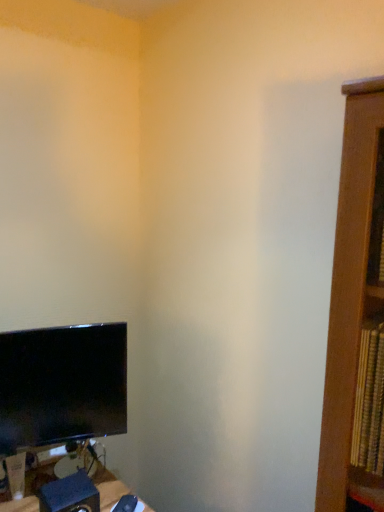
Image resolution: width=384 pixels, height=512 pixels. Describe the element at coordinates (70, 494) in the screenshot. I see `blue matte speaker at lower left` at that location.

What is the approximate width of blue matte speaker at lower left?

It is 5.15 inches.

This screenshot has width=384, height=512. I want to click on blue matte speaker at lower left, so click(70, 494).

What is the approximate height of blue matte speaker at lower left?

blue matte speaker at lower left is 14.59 centimeters in height.

Describe the element at coordinates (62, 385) in the screenshot. I see `black glossy monitor at lower left` at that location.

In order to face black glossy monitor at lower left, should I rotate leftwards or rightwards?

Rotate left and turn 16.584 degrees.

The image size is (384, 512). Identify the location of black glossy monitor at lower left. (62, 385).

Locate an element on the screen. blue matte speaker at lower left is located at coordinates (70, 494).

Based on their positions, is blue matte speaker at lower left located to the left or right of black glossy monitor at lower left?

blue matte speaker at lower left is to the right of black glossy monitor at lower left.

Between blue matte speaker at lower left and black glossy monitor at lower left, which one is positioned in front?

Positioned in front is blue matte speaker at lower left.

Between point (71, 482) and point (113, 405), which one is positioned behind?

Positioned behind is point (113, 405).

From the image's perspective, would you say blue matte speaker at lower left is shown under black glossy monitor at lower left?

Yes.

From a real-world perspective, who is located lower, blue matte speaker at lower left or black glossy monitor at lower left?

blue matte speaker at lower left.

Which object is thinner, blue matte speaker at lower left or black glossy monitor at lower left?

Thinner between the two is black glossy monitor at lower left.

Who is shorter, blue matte speaker at lower left or black glossy monitor at lower left?

Standing shorter between the two is blue matte speaker at lower left.

Does blue matte speaker at lower left have a larger size compared to black glossy monitor at lower left?

No.

From the picture: Would you say black glossy monitor at lower left is part of blue matte speaker at lower left's contents?

Actually, black glossy monitor at lower left is outside blue matte speaker at lower left.

Is blue matte speaker at lower left positioned far away from black glossy monitor at lower left?

Actually, blue matte speaker at lower left and black glossy monitor at lower left are a little close together.

Is blue matte speaker at lower left oriented towards black glossy monitor at lower left?

No.

Can you tell me how much blue matte speaker at lower left and black glossy monitor at lower left differ in facing direction?

They differ by 12.9 degrees in their facing directions.

You are a GUI agent. You are given a task and a screenshot of the screen. Output one action in this format:
    pyautogui.click(x=<x>, y=<y>)
    Task: Click on the computer monitor located on the left of blue matte speaker at lower left
    The width and height of the screenshot is (384, 512).
    Given the screenshot: What is the action you would take?
    pyautogui.click(x=62, y=385)

Which object is positioned more to the right, black glossy monitor at lower left or blue matte speaker at lower left?

Positioned to the right is blue matte speaker at lower left.

Is black glossy monitor at lower left further to camera compared to blue matte speaker at lower left?

Yes, black glossy monitor at lower left is further from the camera.

Is point (76, 352) in front of point (95, 506)?

No, it is behind (95, 506).

From the image's perspective, which one is positioned higher, black glossy monitor at lower left or blue matte speaker at lower left?

black glossy monitor at lower left appears higher in the image.

From a real-world perspective, between black glossy monitor at lower left and blue matte speaker at lower left, who is vertically higher?

In real-world perspective, black glossy monitor at lower left is above.

Considering the sizes of black glossy monitor at lower left and blue matte speaker at lower left in the image, is black glossy monitor at lower left wider or thinner than blue matte speaker at lower left?

Considering their sizes, black glossy monitor at lower left looks slimmer than blue matte speaker at lower left.

From their relative heights in the image, would you say black glossy monitor at lower left is taller or shorter than blue matte speaker at lower left?

black glossy monitor at lower left is taller than blue matte speaker at lower left.

Which of these two, black glossy monitor at lower left or blue matte speaker at lower left, is smaller?

With smaller size is blue matte speaker at lower left.

Is black glossy monitor at lower left positioned beyond the bounds of blue matte speaker at lower left?

black glossy monitor at lower left lies outside blue matte speaker at lower left's area.

Is the surface of black glossy monitor at lower left in direct contact with blue matte speaker at lower left?

There is a gap between black glossy monitor at lower left and blue matte speaker at lower left.

Is blue matte speaker at lower left at the back of black glossy monitor at lower left?

That's not correct — black glossy monitor at lower left is not looking away from blue matte speaker at lower left.

How many degrees apart are the facing directions of black glossy monitor at lower left and blue matte speaker at lower left?

The facing directions of black glossy monitor at lower left and blue matte speaker at lower left are 12.9 degrees apart.

In the image, there is a black glossy monitor at lower left. Where is `speaker below it (from the image's perspective)`? speaker below it (from the image's perspective) is located at coordinates (70, 494).

The width and height of the screenshot is (384, 512). In order to click on speaker on the right of black glossy monitor at lower left in this screenshot , I will do `click(70, 494)`.

Image resolution: width=384 pixels, height=512 pixels. I want to click on speaker below the black glossy monitor at lower left (from the image's perspective), so click(70, 494).